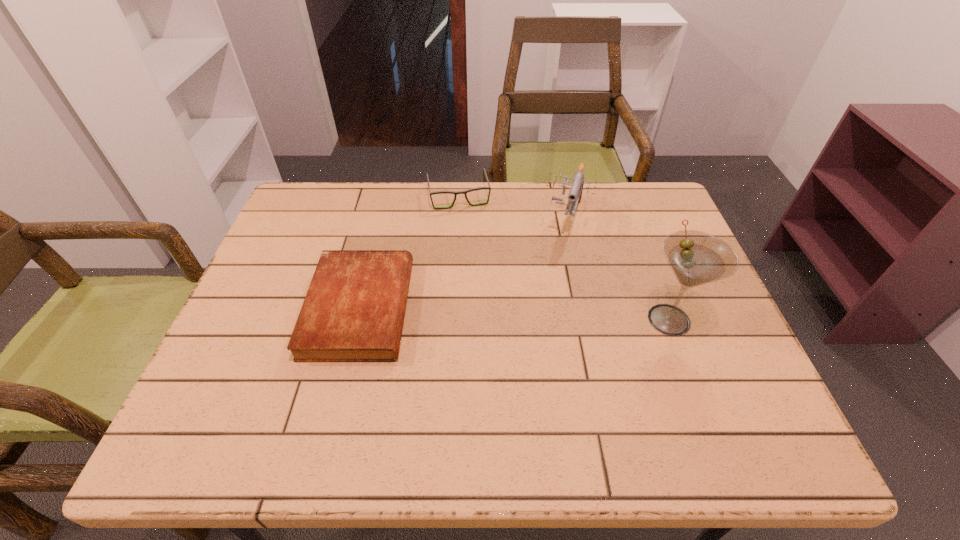
Where is `vacant space that's between the shortest object and the rightmost object`? The height and width of the screenshot is (540, 960). vacant space that's between the shortest object and the rightmost object is located at coordinates (515, 314).

Where is `free space between the leftmost object and the martini`? The image size is (960, 540). free space between the leftmost object and the martini is located at coordinates (515, 314).

The image size is (960, 540). I want to click on free space that is in between the third shortest object and the rightmost object, so click(618, 268).

I want to click on vacant space that is in between the third shortest object and the martini, so click(x=618, y=268).

Select which object appears as the closest to the third object from right to left. Please provide its 2D coordinates. Your answer should be formatted as a tuple, i.e. [(x, y)], where the tuple contains the x and y coordinates of a point satisfying the conditions above.

[(575, 194)]

At what (x,y) coordinates should I click in order to perform the action: click on object that can be found as the third closest to the second shortest object. Please return your answer as a coordinate pair (x, y). Looking at the image, I should click on (696, 258).

I want to click on free location that satisfies the following two spatial constraints: 1. on the front side of the gun; 2. on the left side of the third tallest object, so click(x=457, y=217).

This screenshot has height=540, width=960. Identify the location of vacant area in the image that satisfies the following two spatial constraints: 1. on the front side of the second shortest object; 2. on the right side of the tallest object. (451, 319).

Identify the location of vacant area that satisfies the following two spatial constraints: 1. on the front side of the gun; 2. on the left side of the spectacles. (457, 217).